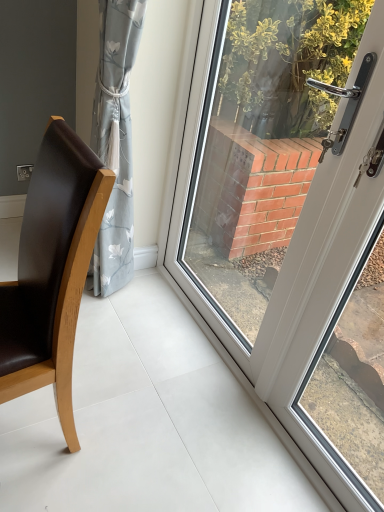
Question: Based on their positions, is white glossy door at center located to the left or right of brown leather chair at left?

Choices:
 (A) left
 (B) right

Answer: (B)

Question: Considering the positions of white glossy door at center and brown leather chair at left in the image, is white glossy door at center wider or thinner than brown leather chair at left?

Choices:
 (A) wide
 (B) thin

Answer: (B)

Question: Is white glossy door at center in front of or behind brown leather chair at left in the image?

Choices:
 (A) front
 (B) behind

Answer: (A)

Question: Is brown leather chair at left taller or shorter than white glossy door at center?

Choices:
 (A) tall
 (B) short

Answer: (B)

Question: Which is correct: brown leather chair at left is inside white glossy door at center, or outside of it?

Choices:
 (A) inside
 (B) outside

Answer: (B)

Question: From the image's perspective, is brown leather chair at left above or below white glossy door at center?

Choices:
 (A) below
 (B) above

Answer: (A)

Question: From a real-world perspective, relative to white glossy door at center, is brown leather chair at left vertically above or below?

Choices:
 (A) below
 (B) above

Answer: (A)